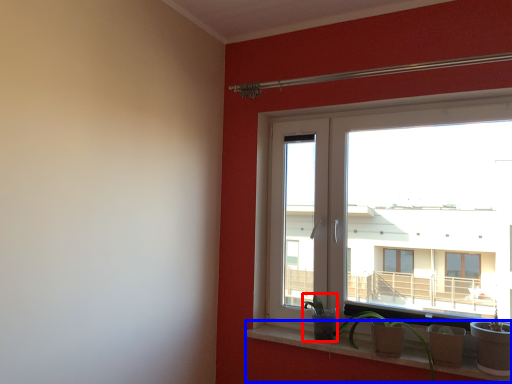
Question: Which object is further to the camera taking this photo, plant (highlighted by a red box) or window sill (highlighted by a blue box)?

Choices:
 (A) plant
 (B) window sill

Answer: (A)